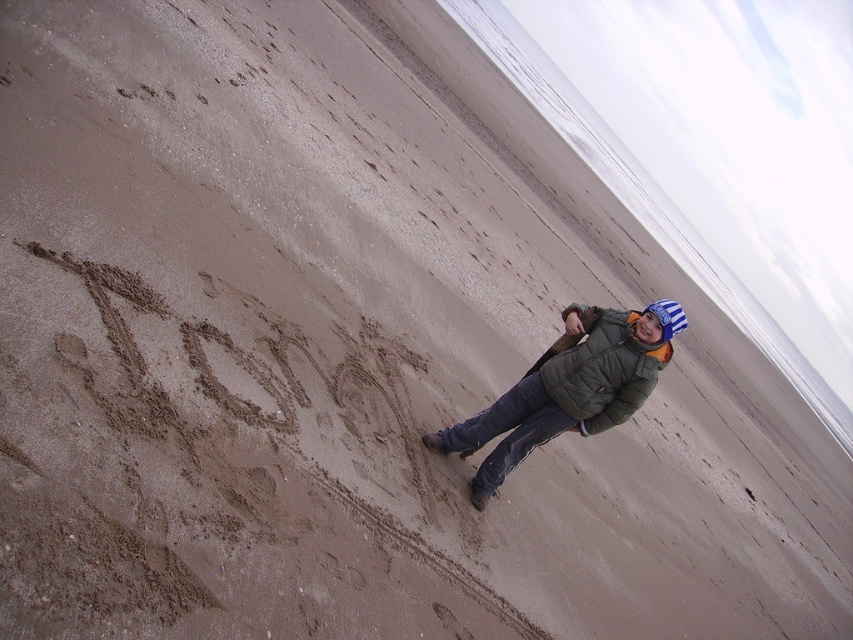
Between green fuzzy jacket at center and green matte jacket at lower right, which one appears on the right side from the viewer's perspective?

green matte jacket at lower right

Between green fuzzy jacket at center and green matte jacket at lower right, which one has less height?

With less height is green matte jacket at lower right.

Does point (607, 317) come behind point (610, 417)?

That is True.

Image resolution: width=853 pixels, height=640 pixels. I want to click on green fuzzy jacket at center, so click(569, 388).